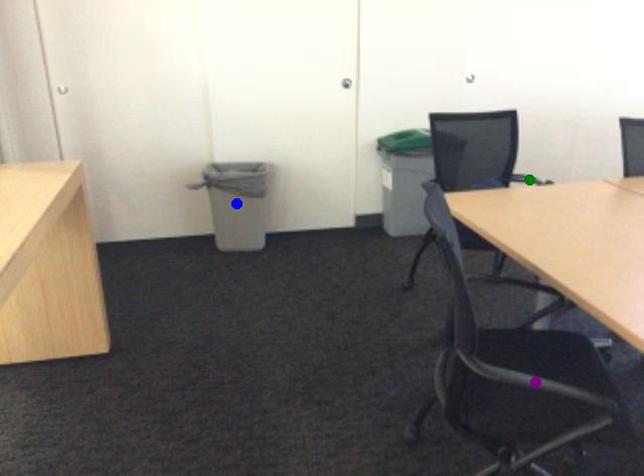
Order these from nearest to farthest:
- purple point
- blue point
- green point

1. purple point
2. blue point
3. green point